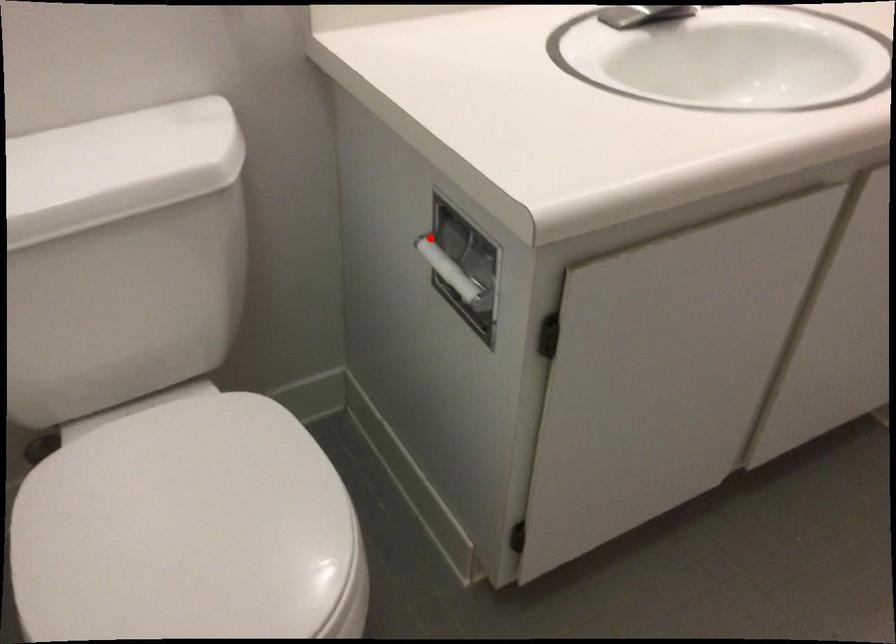
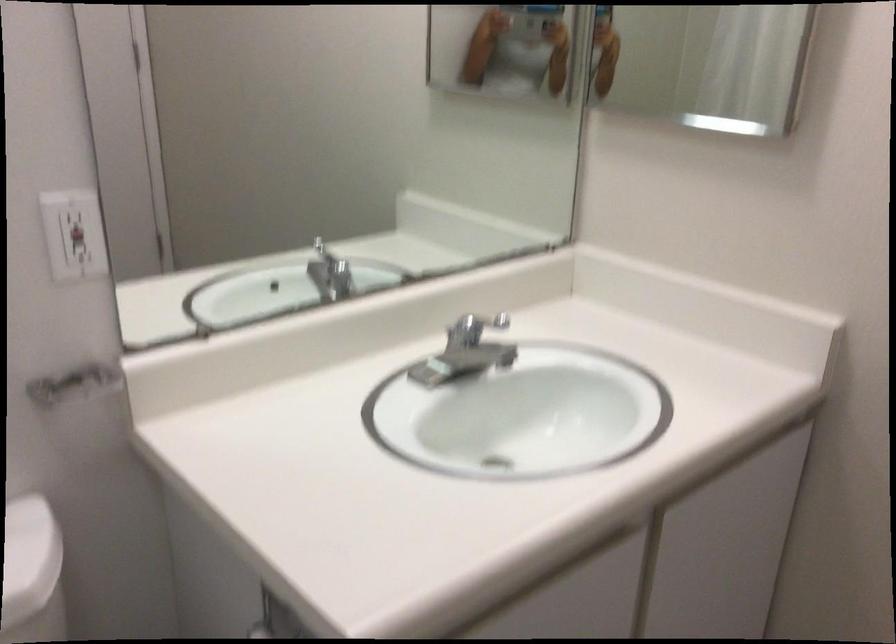
In the second image, find the point that corresponds to the highlighted location in the first image.

(259, 630)